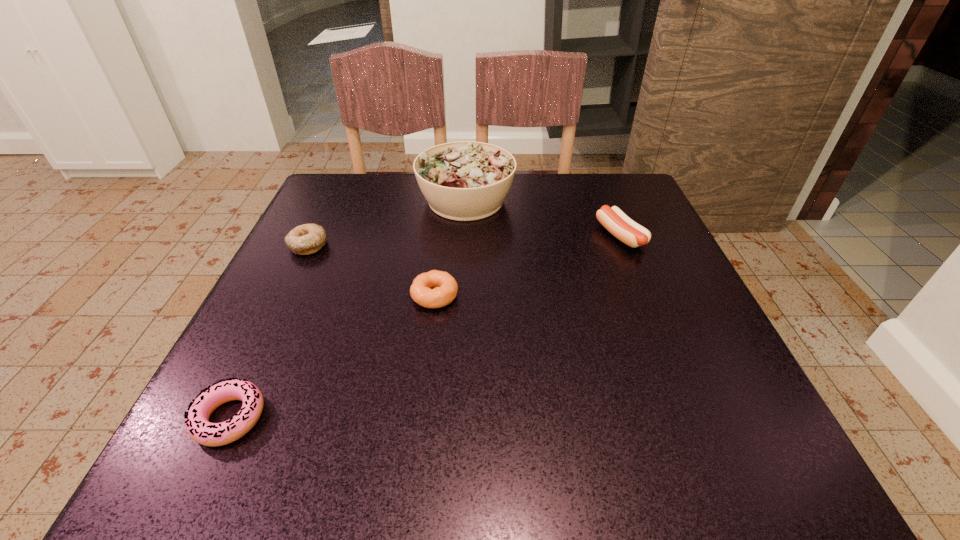
Image resolution: width=960 pixels, height=540 pixels. Identify the location of empty location between the nearest doughnut and the rightmost object. (425, 327).

Locate an element on the screen. The height and width of the screenshot is (540, 960). unoccupied area between the second nearest object and the farthest doughnut is located at coordinates [x=372, y=271].

You are a GUI agent. You are given a task and a screenshot of the screen. Output one action in this format:
    pyautogui.click(x=<x>, y=<y>)
    Task: Click on the free space between the nearest object and the farthest doughnut
    The height and width of the screenshot is (540, 960).
    Given the screenshot: What is the action you would take?
    pyautogui.click(x=269, y=332)

Locate an element on the screen. Image resolution: width=960 pixels, height=540 pixels. the fourth closest object to the second nearest object is located at coordinates (629, 232).

What are the coordinates of `object that is the second closest to the farthest doughnut` in the screenshot? It's located at (434, 289).

Locate which doughnut is the closest to the nearest object. Please provide its 2D coordinates. Your answer should be formatted as a tuple, i.e. [(x, y)], where the tuple contains the x and y coordinates of a point satisfying the conditions above.

[(434, 289)]

Find the location of `the closest doughnut to the rightmost object`. the closest doughnut to the rightmost object is located at coordinates (434, 289).

You are a GUI agent. You are given a task and a screenshot of the screen. Output one action in this format:
    pyautogui.click(x=<x>, y=<y>)
    Task: Click on the free location that satisfies the following two spatial constraints: 1. on the back side of the sausage; 2. on the right side of the nearest object
    This screenshot has width=960, height=540.
    Given the screenshot: What is the action you would take?
    pyautogui.click(x=317, y=235)

Image resolution: width=960 pixels, height=540 pixels. In order to click on vacant space that satisfies the following two spatial constraints: 1. on the front side of the tallest object; 2. on the right side of the sausage in this screenshot , I will do pos(465,235).